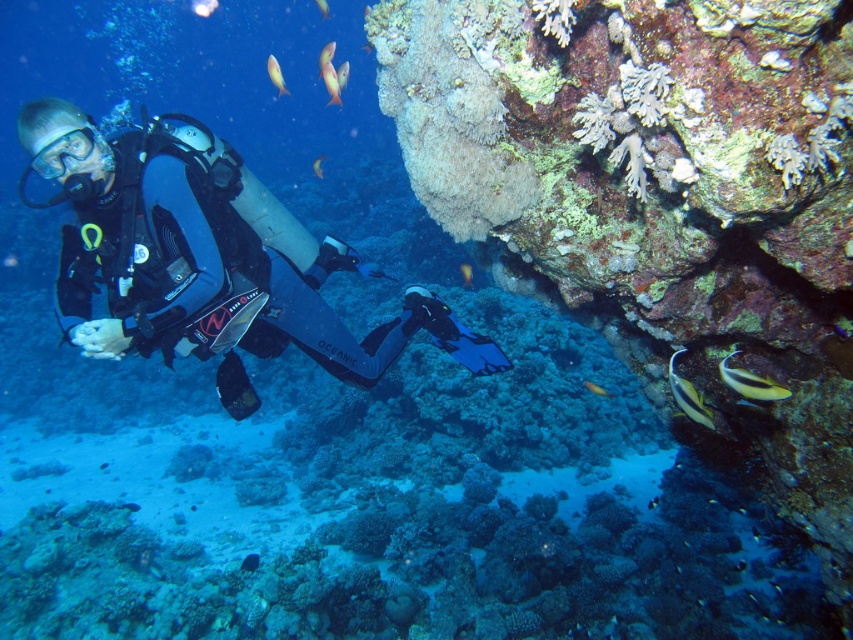
You are a marine biologist analyzing an underwater image. The image shows two points labeled as point 1 at coordinate (465, 269) and point 2 at coordinate (325, 13). Based on the depth information, which point is closer to the camera?

Point 1 at coordinate (465, 269) is closer to the camera than point 2 at coordinate (325, 13).

Based on the photo, you are a marine biologist analyzing an underwater image. You need to locate the matte black goggles at upper left. What are their exact coordinates in the image?

The exact coordinates of the matte black goggles at upper left are at point [62,150].

You are a marine biologist studying fish in the coral reef. You notice two fish in the image, the shiny silver fish at center and the shiny orange fish at upper center. Which fish is shorter in height?

The shiny silver fish at center is not as tall as the shiny orange fish at upper center, so the shiny silver fish at center is shorter in height.